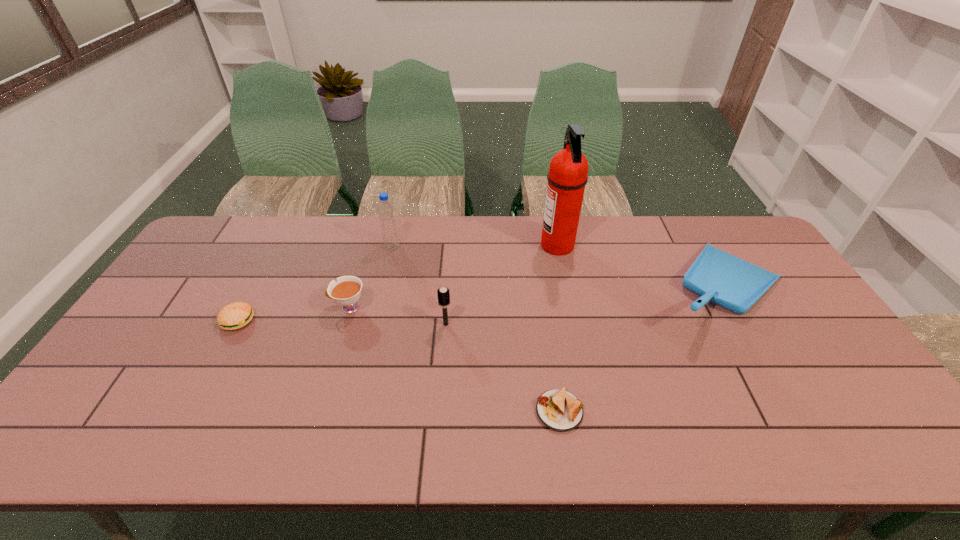
The height and width of the screenshot is (540, 960). I want to click on vacant point at the left edge, so click(x=199, y=316).

Where is `vacant space at the near left corner`? Image resolution: width=960 pixels, height=540 pixels. vacant space at the near left corner is located at coordinates (90, 436).

At what (x,y) coordinates should I click in order to perform the action: click on free point between the fire extinguisher and the third object from left to right. Please return your answer as a coordinate pair (x, y). Image resolution: width=960 pixels, height=540 pixels. Looking at the image, I should click on (475, 246).

I want to click on free area in between the sixth tallest object and the second object from left to right, so click(x=293, y=314).

Find the location of `free space between the rightmost object and the sandwich`. free space between the rightmost object and the sandwich is located at coordinates (640, 350).

The width and height of the screenshot is (960, 540). In order to click on unoccupied position between the fourth object from left to right and the dustpan in this screenshot , I will do `click(584, 306)`.

This screenshot has height=540, width=960. In order to click on empty location between the sixth shortest object and the second shortest object in this screenshot , I will do `click(315, 284)`.

Locate an element on the screen. The width and height of the screenshot is (960, 540). free spot between the second tallest object and the patty is located at coordinates (315, 284).

This screenshot has width=960, height=540. Find the location of `vacant space in between the second object from left to right and the water bottle`. vacant space in between the second object from left to right and the water bottle is located at coordinates (371, 277).

Locate an element on the screen. This screenshot has width=960, height=540. unoccupied area between the patty and the teacup is located at coordinates (293, 314).